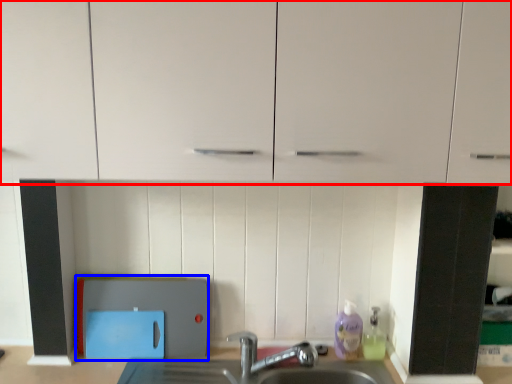
Question: Which object is closer to the camera taking this photo, cabinetry (highlighted by a red box) or appliance (highlighted by a blue box)?

Choices:
 (A) cabinetry
 (B) appliance

Answer: (A)